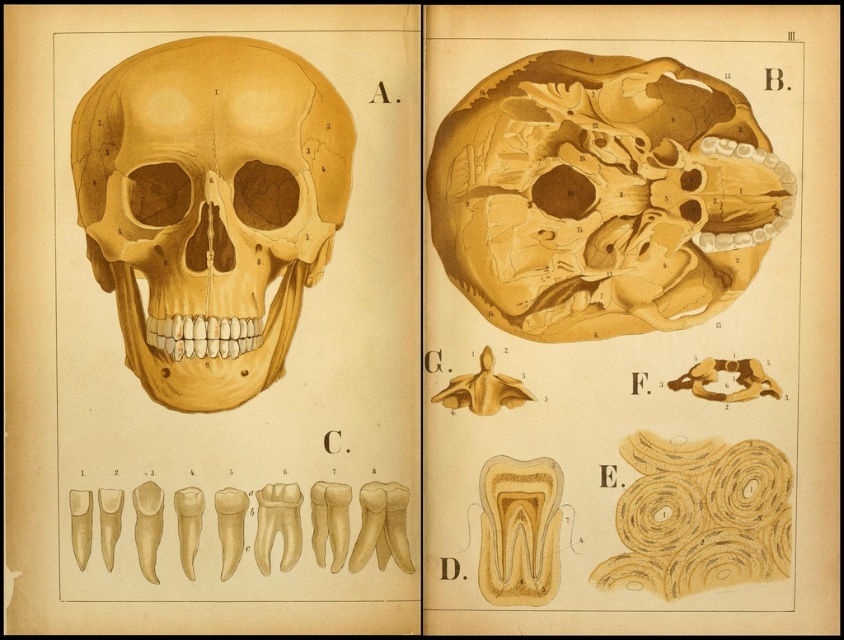
Can you confirm if matte yellow skull at upper right is positioned to the right of matte yellow skull at center?

Indeed, matte yellow skull at upper right is positioned on the right side of matte yellow skull at center.

Is matte yellow skull at upper right positioned before matte yellow skull at center?

No.

What do you see at coordinates (602, 195) in the screenshot? This screenshot has height=640, width=844. I see `matte yellow skull at upper right` at bounding box center [602, 195].

What are the coordinates of `matte yellow skull at upper right` in the screenshot? It's located at (602, 195).